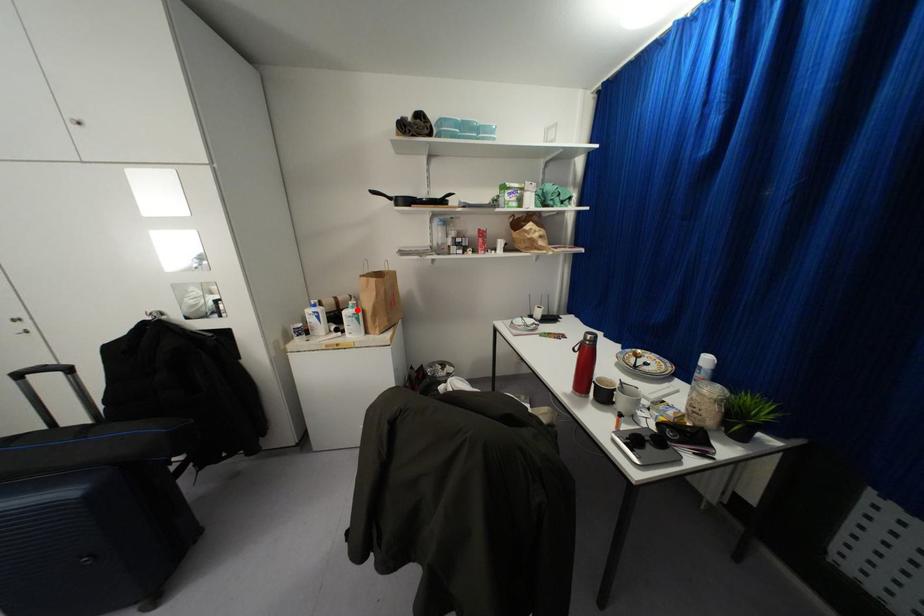
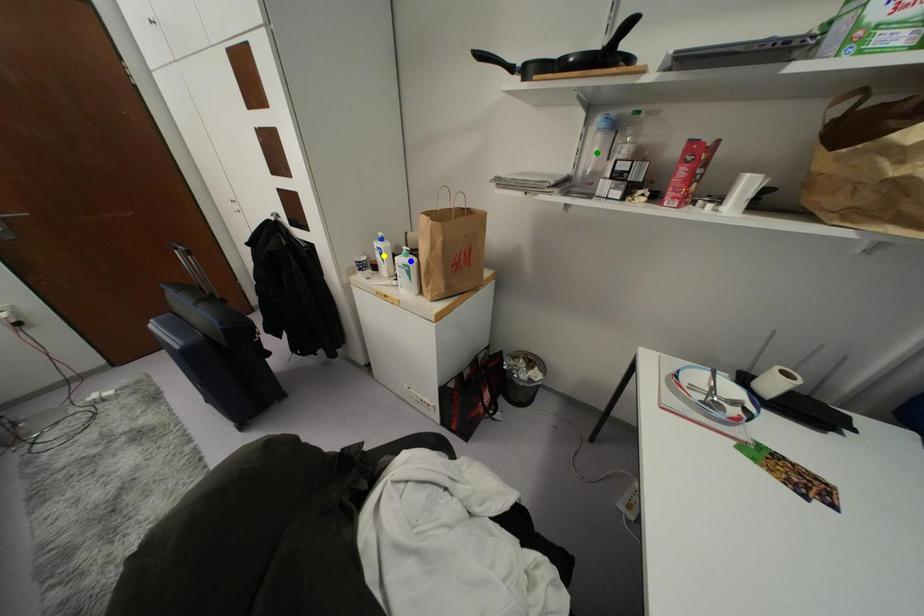
Question: I am providing you with two images of the same scene from different viewpoints. A red point is marked on the first image. You are given multiple points on the second image. In image 2, which mark is for the same physical point as the one in image 1?

Choices:
 (A) yellow point
 (B) blue point
 (C) green point

Answer: (B)